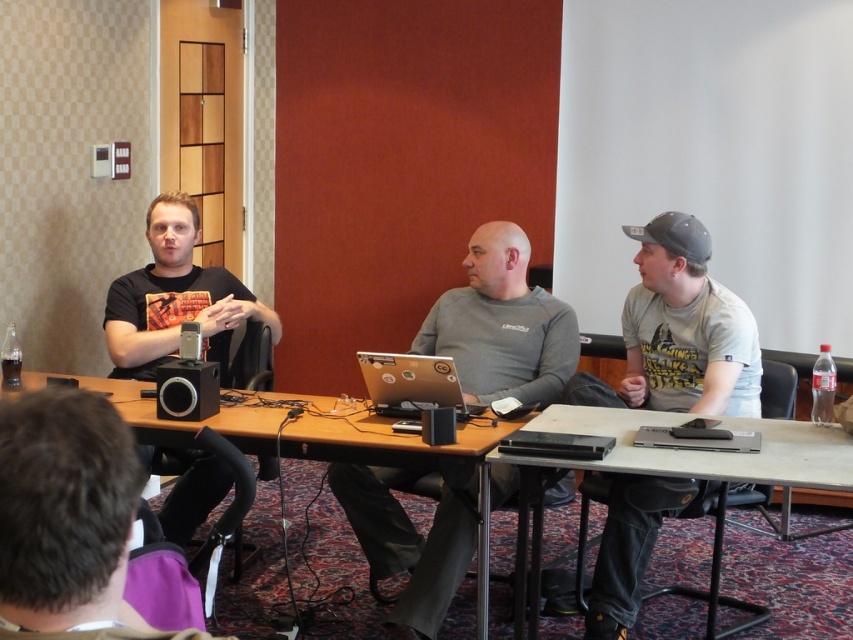
You are a person who needs to place a 15 cm tall model airplane on the table. Which table should you choose between the wooden table at center and the black plastic table at center to ensure the model airplane won

The wooden table at center is taller than the black plastic table at center, so placing the 15 cm tall model airplane on the wooden table at center would be more stable and appropriate as it provides a higher surface.

From the picture: You are standing at the point with coordinates point (x=115, y=310) and want to move to the point with coordinates point (x=712, y=440). Which direction should you move to reach your destination?

To move from point (x=115, y=310) to point (x=712, y=440), you should move forward since point (x=115, y=310) is behind point (x=712, y=440).